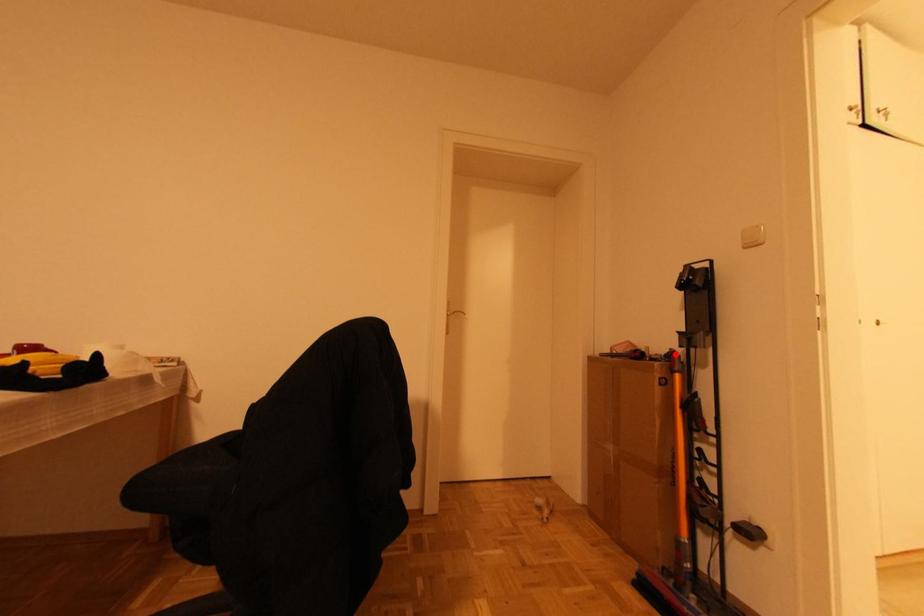
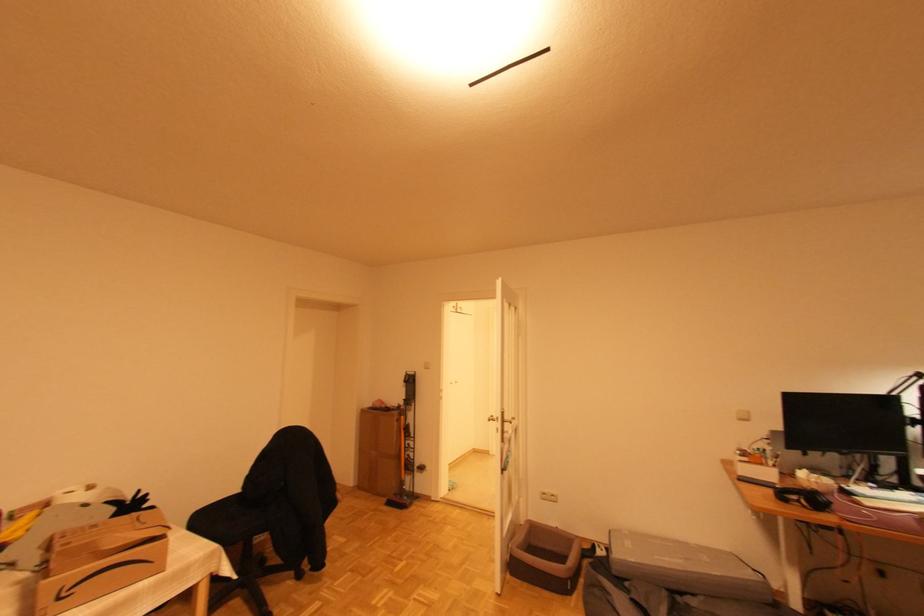
Find the pixel in the second image that matches the highlighted location in the first image.

(402, 407)